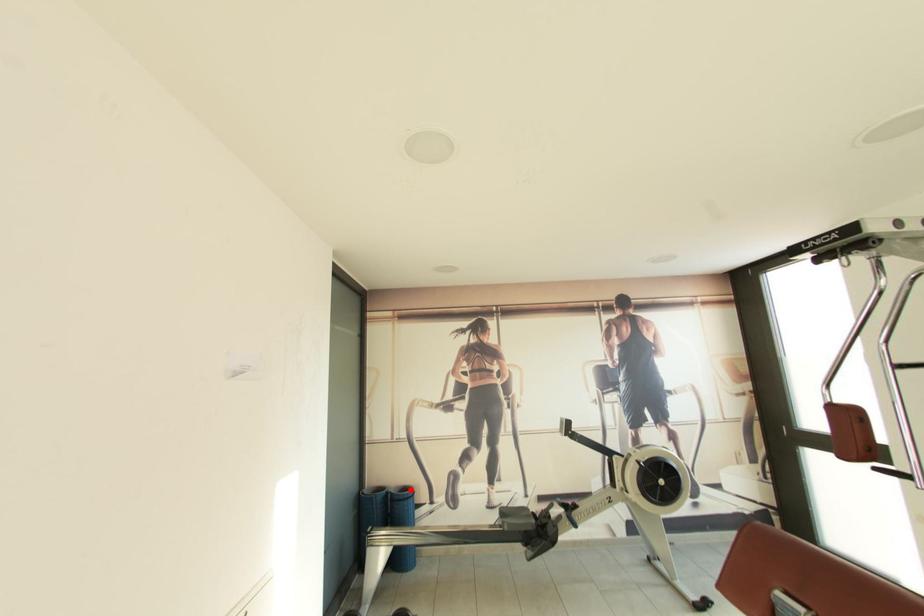
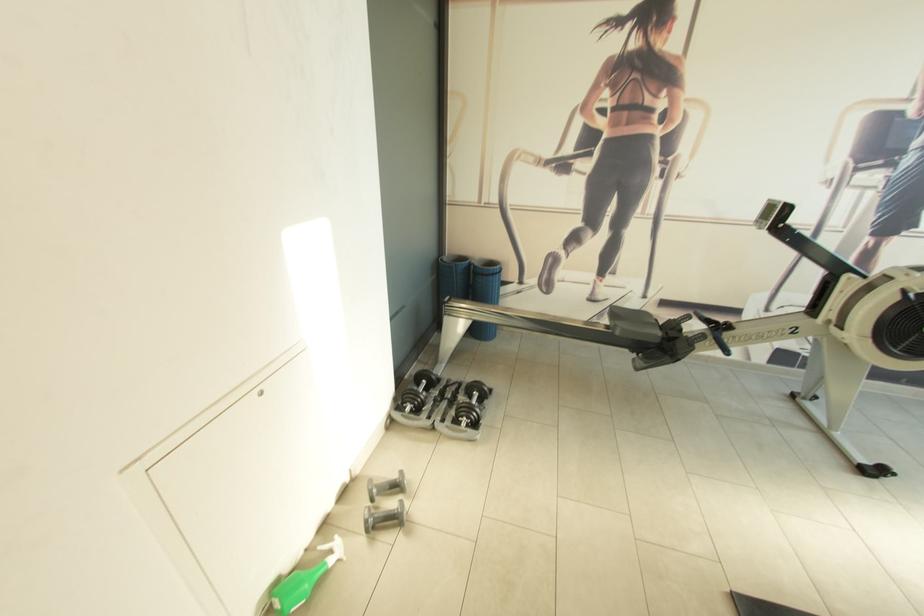
Locate, in the second image, the point that corresponds to the highlighted location in the first image.

(497, 265)